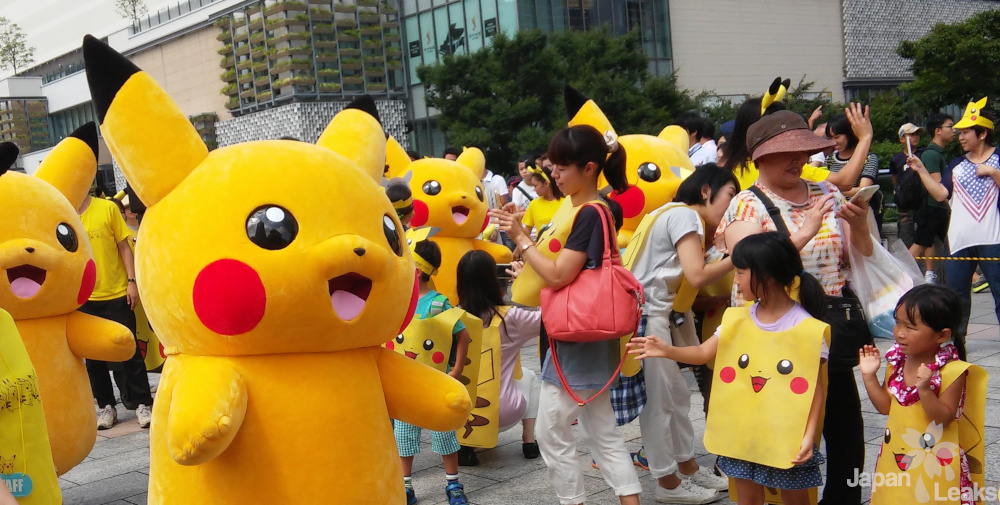
Locate an element on the screen. This screenshot has width=1000, height=505. grey cement block style ground design is located at coordinates (124, 483), (517, 491), (994, 378).